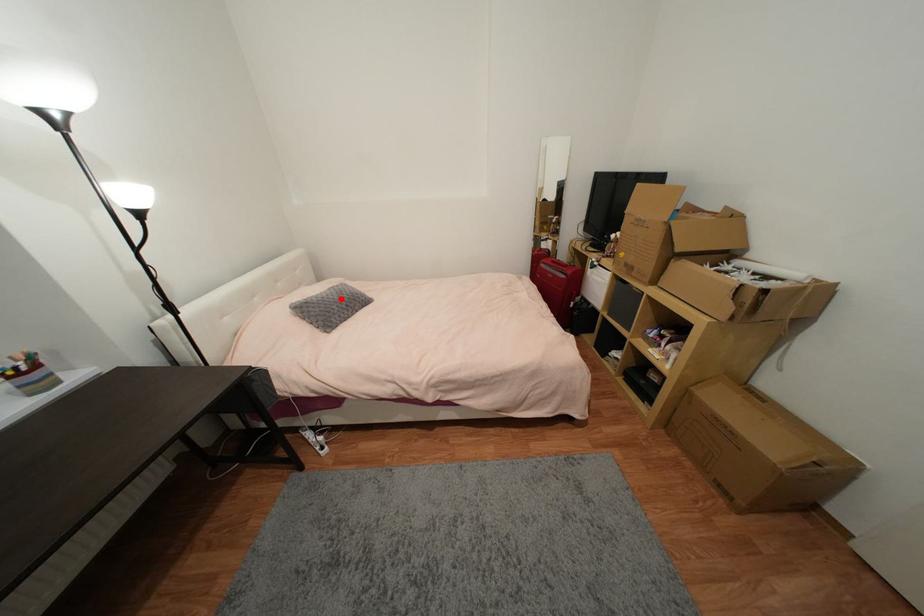
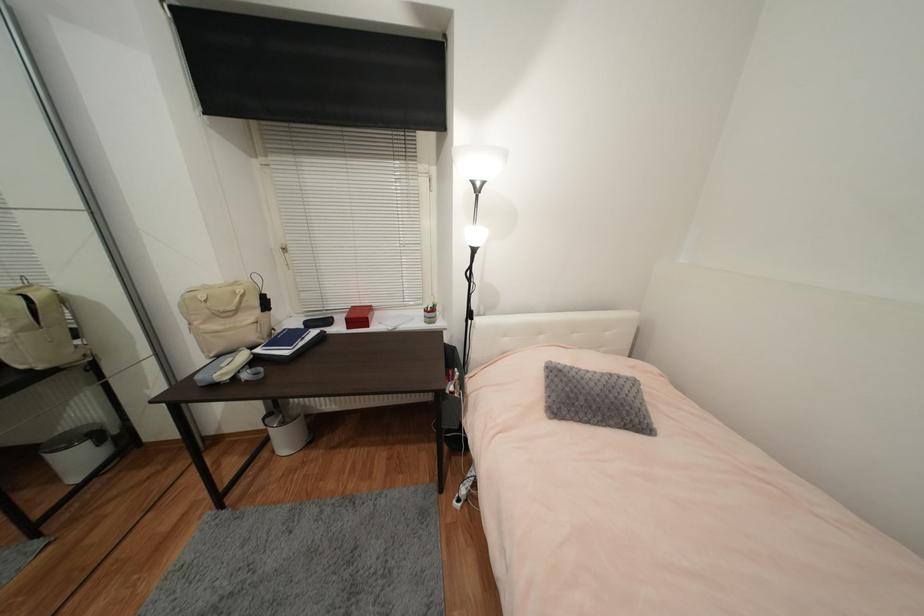
Question: I am providing you with two images of the same scene from different viewpoints. In image1, a red point is highlighted. Considering the same 3D point in image2, which of the following is correct?

Choices:
 (A) It is closer
 (B) It is farther

Answer: (B)